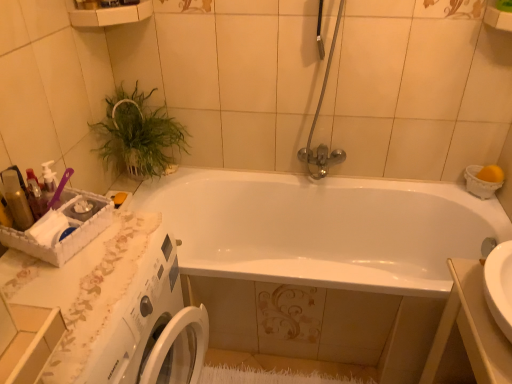
Question: Is white glossy sink at lower right situated inside green leafy plant at upper left or outside?

Choices:
 (A) outside
 (B) inside

Answer: (A)

Question: Considering the positions of white glossy sink at lower right and green leafy plant at upper left in the image, is white glossy sink at lower right bigger or smaller than green leafy plant at upper left?

Choices:
 (A) big
 (B) small

Answer: (A)

Question: Which is farther from the white glossy bathtub at center?

Choices:
 (A) shiny plastic bottles at left
 (B) chrome metallic shower door at upper center
 (C) white lace counter top at lower left
 (D) white glossy sink at lower right
 (E) green leafy plant at upper left

Answer: (A)

Question: Estimate the real-world distances between objects in this image. Which object is closer to the shiny plastic bottles at left?

Choices:
 (A) chrome metallic shower door at upper center
 (B) white lace counter top at lower left
 (C) green leafy plant at upper left
 (D) white glossy bathtub at center
 (E) white glossy sink at lower right

Answer: (B)